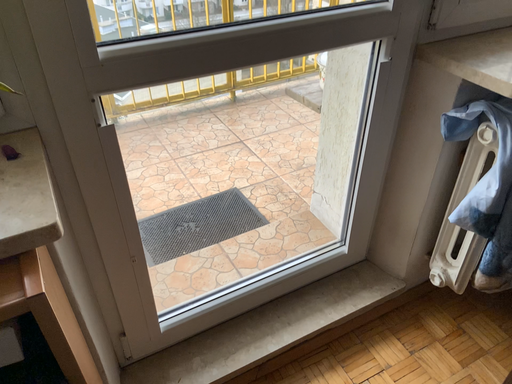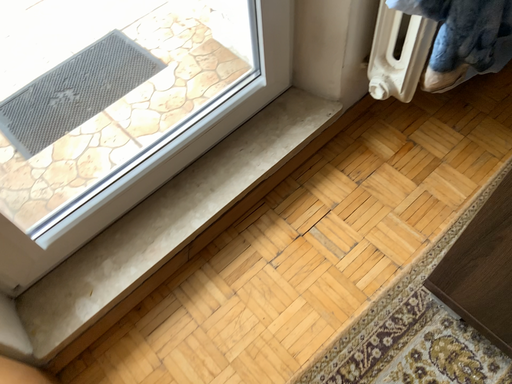
Question: Which way did the camera rotate in the video?

Choices:
 (A) rotated downward
 (B) rotated upward

Answer: (A)